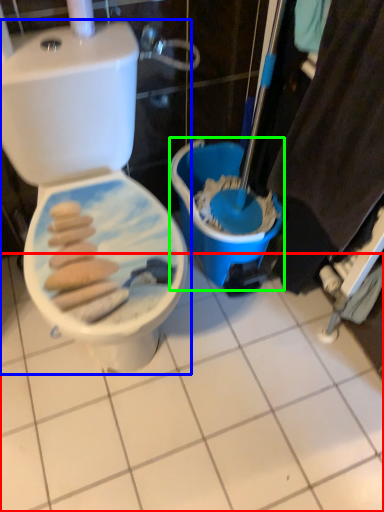
Question: Based on their relative distances, which object is nearer to ceramic tile (highlighted by a red box)? Choose from toilet (highlighted by a blue box) and potty (highlighted by a green box).

Choices:
 (A) toilet
 (B) potty

Answer: (B)